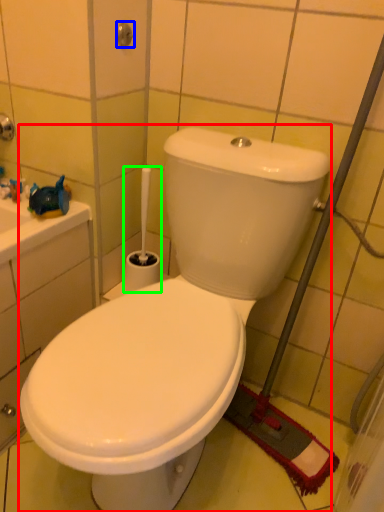
Question: Which is farther away from toilet (highlighted by a red box)? shower (highlighted by a blue box) or brush (highlighted by a green box)?

Choices:
 (A) shower
 (B) brush

Answer: (A)